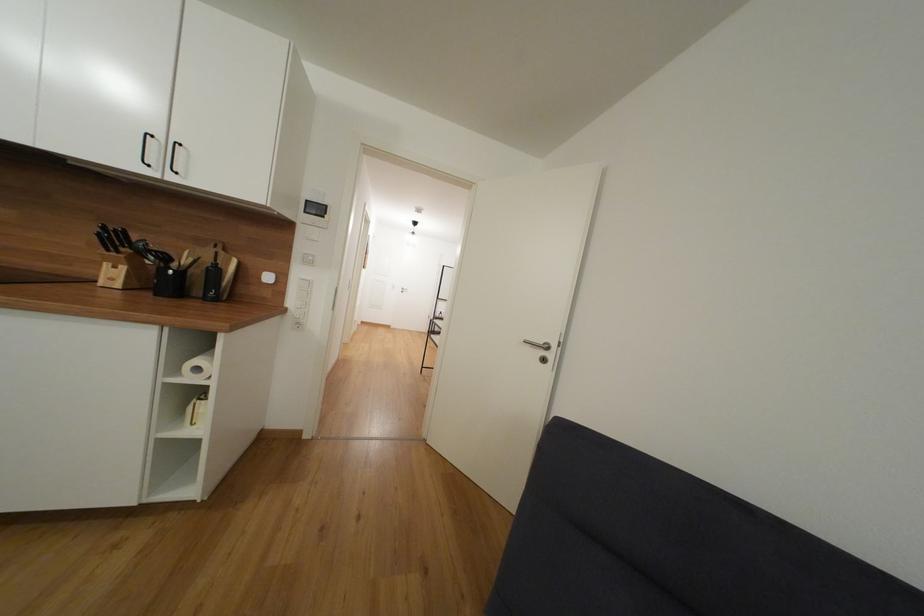
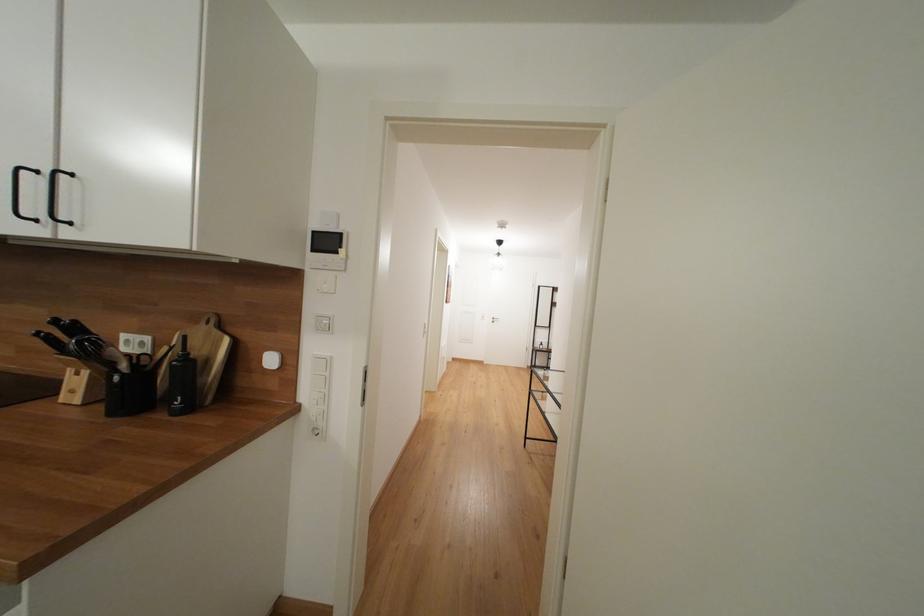
Question: The first image is from the beginning of the video and the second image is from the end. How did the camera likely rotate when shooting the video?

Choices:
 (A) Left
 (B) Right
 (C) Up
 (D) Down

Answer: (A)